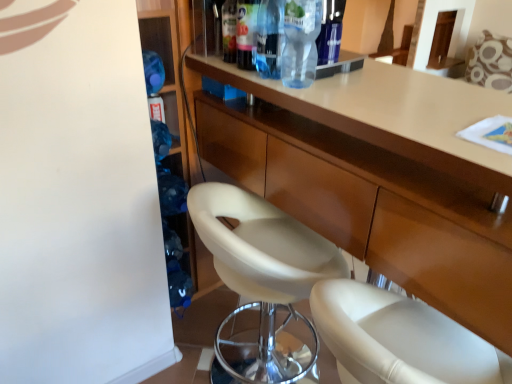
Find the location of a particular element. The height and width of the screenshot is (384, 512). free region on the left part of transparent plastic bottle at upper center, which is counted as the third bottle, starting from the right is located at coordinates (238, 73).